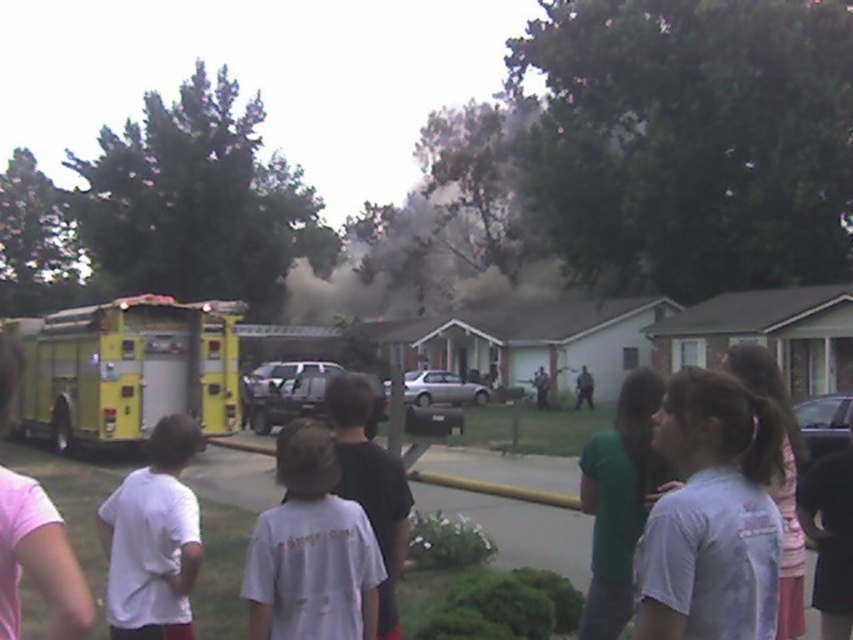
A firefighter needs to reach the fire truck parked on the left side. They are currently standing at point (440, 228). Is there a clear path to the fire truck without going through the black dust cloud at center?

The point (440, 228) is located on the black dust cloud at center, so the firefighter would need to avoid this area to reach the fire truck parked on the left side. The path may not be clear if the dust cloud obstructs the route.

You are a firefighter trying to reach the fire truck at point (323,602). There is an obstacle at point (503,289). Can you go around the obstacle to reach the fire truck?

Point (503,289) is behind point (323,602), so you can go around the obstacle at point (503,289) to reach the fire truck at point (323,602).